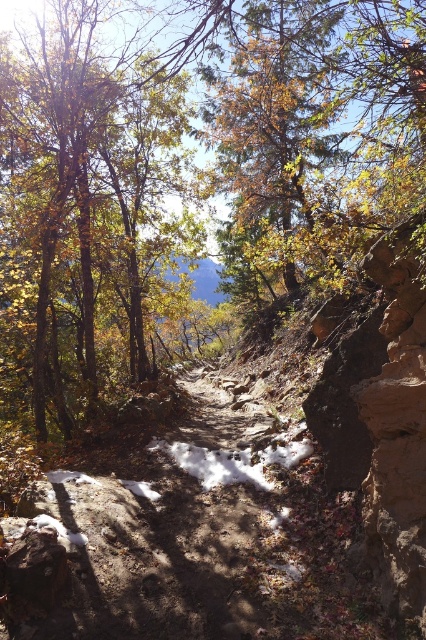
You are a hiker carrying a backpack and want to take a photo of the brown leafy tree at center and the white fluffy snow at center. Which object will appear wider in your photo?

The brown leafy tree at center will appear wider in the photo since its width surpasses that of the white fluffy snow at center.